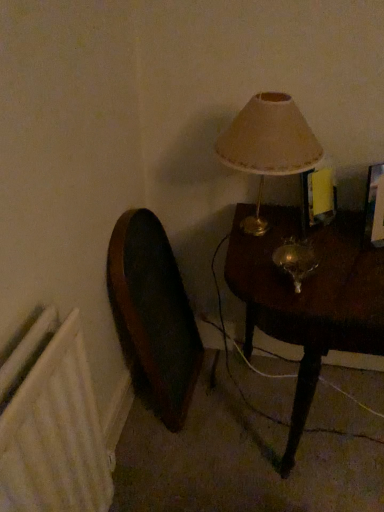
Image resolution: width=384 pixels, height=512 pixels. I want to click on empty space that is ontop of mahogany wood table at right (from a real-world perspective), so click(316, 246).